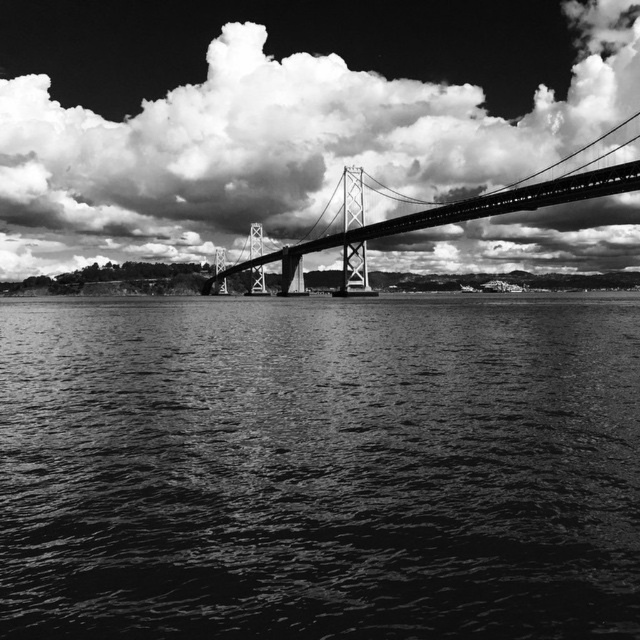
Is point (52, 129) in front of point (392, 218)?

That is False.

Does cloudy sky at upper center have a lesser width compared to metallic bridge at center?

In fact, cloudy sky at upper center might be wider than metallic bridge at center.

In the scene shown: Who is more forward, [220,195] or [438,220]?

Point [438,220] is in front.

Locate an element on the screen. This screenshot has width=640, height=640. cloudy sky at upper center is located at coordinates (275, 147).

Does point (484, 364) come farther from viewer compared to point (461, 136)?

No, it is not.

Does dark water at center have a lesser width compared to cloudy sky at upper center?

Yes.

Is point (474, 428) behind point (259, 90)?

No, it is in front of (259, 90).

Image resolution: width=640 pixels, height=640 pixels. I want to click on dark water at center, so [x=320, y=468].

Is dark water at center closer to camera compared to metallic bridge at center?

Yes, it is in front of metallic bridge at center.

Which is more to the left, dark water at center or metallic bridge at center?

dark water at center is more to the left.

Between point (465, 579) and point (250, 268), which one is positioned in front?

Point (465, 579) is in front.

The width and height of the screenshot is (640, 640). I want to click on dark water at center, so click(x=320, y=468).